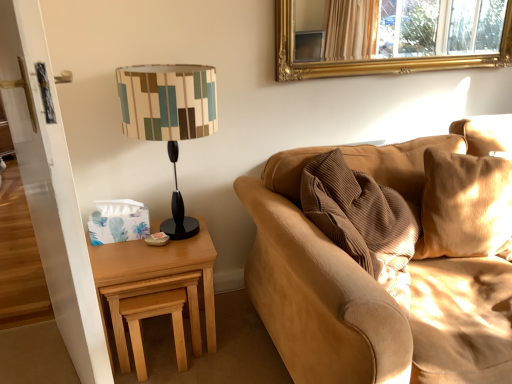
This screenshot has width=512, height=384. I want to click on beige suede pillow at right, so click(465, 206).

What do you see at coordinates (465, 206) in the screenshot? I see `beige suede pillow at right` at bounding box center [465, 206].

You are a GUI agent. You are given a task and a screenshot of the screen. Output one action in this format:
    pyautogui.click(x=<x>, y=<y>)
    Task: Click on the matte black lampshade at left
    
    Given the screenshot: What is the action you would take?
    pyautogui.click(x=169, y=118)

This screenshot has width=512, height=384. Identify the location of gold ornate mirror at upper center. (389, 36).

This screenshot has height=384, width=512. In order to click on light brown wood stool at lower left in this screenshot , I will do `click(153, 316)`.

What is the approximate width of corduroy fabric couch at right?

The width of corduroy fabric couch at right is 53.04 centimeters.

Measure the distance between corduroy fabric couch at right and camera.

corduroy fabric couch at right and camera are 38.78 inches apart.

Find the location of a particular element. light brown wood at left is located at coordinates (159, 277).

Which is less distant, (414, 32) or (284, 212)?

Clearly, point (414, 32) is more distant from the camera than point (284, 212).

Is gold ornate mirror at upper center aimed at corduroy fabric couch at right?

No, gold ornate mirror at upper center is not turned towards corduroy fabric couch at right.

Between gold ornate mirror at upper center and corduroy fabric couch at right, which one has less height?

With less height is gold ornate mirror at upper center.

Considering the sizes of objects beige suede pillow at right and gold ornate mirror at upper center in the image provided, who is smaller, beige suede pillow at right or gold ornate mirror at upper center?

gold ornate mirror at upper center.

This screenshot has height=384, width=512. Find the location of `pillow located underneath the gold ornate mirror at upper center (from a real-world perspective)`. pillow located underneath the gold ornate mirror at upper center (from a real-world perspective) is located at coordinates point(465,206).

Does beige suede pillow at right have a greater width compared to gold ornate mirror at upper center?

Yes.

Is beige suede pillow at right facing away from matte black lampshade at left?

No.

At what (x,y) coordinates should I click in order to perform the action: click on lamp to the left of beige suede pillow at right. Please return your answer as a coordinate pair (x, y). Looking at the image, I should click on (169, 118).

From the image's perspective, which one is positioned lower, beige suede pillow at right or matte black lampshade at left?

beige suede pillow at right, from the image's perspective.

Which is closer, (207, 279) or (175, 337)?

Point (207, 279) appears to be closer to the viewer than point (175, 337).

Between light brown wood at left and light brown wood stool at lower left, which one has more height?

light brown wood at left is taller.

Is light brown wood at left positioned with its back to light brown wood stool at lower left?

Yes, light brown wood stool at lower left is at the back of light brown wood at left.

Where is `stool that appears below the light brown wood at left (from a real-world perspective)`? stool that appears below the light brown wood at left (from a real-world perspective) is located at coordinates pos(153,316).

Does beige suede pillow at right contain corduroy fabric couch at right?

No, corduroy fabric couch at right is not inside beige suede pillow at right.

From a real-world perspective, which object stands above the other?

beige suede pillow at right.

Identify the location of studio couch below the gold ornate mirror at upper center (from a real-world perspective). This screenshot has width=512, height=384. (367, 300).

Is corduroy fabric couch at right far away from gold ornate mirror at upper center?

corduroy fabric couch at right is near gold ornate mirror at upper center, not far away.

Is corduroy fabric couch at right inside the boundaries of gold ornate mirror at upper center, or outside?

corduroy fabric couch at right exists outside the volume of gold ornate mirror at upper center.

Which object is positioned more to the left, corduroy fabric couch at right or gold ornate mirror at upper center?

Positioned to the left is corduroy fabric couch at right.

Is corduroy fabric couch at right outside of light brown wood stool at lower left?

corduroy fabric couch at right is positioned outside light brown wood stool at lower left.

Considering the relative positions of corduroy fabric couch at right and light brown wood stool at lower left in the image provided, is corduroy fabric couch at right to the left of light brown wood stool at lower left from the viewer's perspective?

In fact, corduroy fabric couch at right is to the right of light brown wood stool at lower left.

From a real-world perspective, is corduroy fabric couch at right physically above light brown wood stool at lower left?

Yes, from a real-world perspective, corduroy fabric couch at right is over light brown wood stool at lower left

Is there a large distance between corduroy fabric couch at right and light brown wood stool at lower left?

No.

Where is `studio couch below the gold ornate mirror at upper center (from the image's perspective)`? The height and width of the screenshot is (384, 512). studio couch below the gold ornate mirror at upper center (from the image's perspective) is located at coordinates tap(367, 300).

Identify the location of pillow beneath the gold ornate mirror at upper center (from a real-world perspective). Image resolution: width=512 pixels, height=384 pixels. (465, 206).

Estimate the real-world distances between objects in this image. Which object is further from light brown wood at left, corduroy fabric couch at right or light brown wood stool at lower left?

Among the two, corduroy fabric couch at right is located further to light brown wood at left.

From the image, which object appears to be nearer to light brown wood at left, beige suede pillow at right or corduroy fabric couch at right?

corduroy fabric couch at right.

Estimate the real-world distances between objects in this image. Which object is closer to gold ornate mirror at upper center, light brown wood stool at lower left or beige suede pillow at right?

beige suede pillow at right is closer to gold ornate mirror at upper center.

Based on their spatial positions, is light brown wood stool at lower left or matte black lampshade at left closer to corduroy fabric couch at right?

matte black lampshade at left.

Estimate the real-world distances between objects in this image. Which object is closer to matte black lampshade at left, light brown wood stool at lower left or light brown wood at left?

Based on the image, light brown wood at left appears to be nearer to matte black lampshade at left.

Estimate the real-world distances between objects in this image. Which object is closer to gold ornate mirror at upper center, beige suede pillow at right or light brown wood at left?

Based on the image, beige suede pillow at right appears to be nearer to gold ornate mirror at upper center.

Considering their positions, is matte black lampshade at left positioned closer to light brown wood at left than corduroy fabric couch at right?

Based on the image, corduroy fabric couch at right appears to be nearer to light brown wood at left.

Looking at the image, which one is located further to gold ornate mirror at upper center, light brown wood at left or matte black lampshade at left?

The object further to gold ornate mirror at upper center is light brown wood at left.

I want to click on lamp located between light brown wood stool at lower left and beige suede pillow at right in the left-right direction, so click(x=169, y=118).

At what (x,y) coordinates should I click in order to perform the action: click on nightstand between gold ornate mirror at upper center and light brown wood stool at lower left from top to bottom. Please return your answer as a coordinate pair (x, y). Looking at the image, I should click on (159, 277).

Where is `stool situated between light brown wood at left and corduroy fabric couch at right from left to right`? The image size is (512, 384). stool situated between light brown wood at left and corduroy fabric couch at right from left to right is located at coordinates (153, 316).

The width and height of the screenshot is (512, 384). Identify the location of mirror situated between light brown wood at left and beige suede pillow at right from left to right. (389, 36).